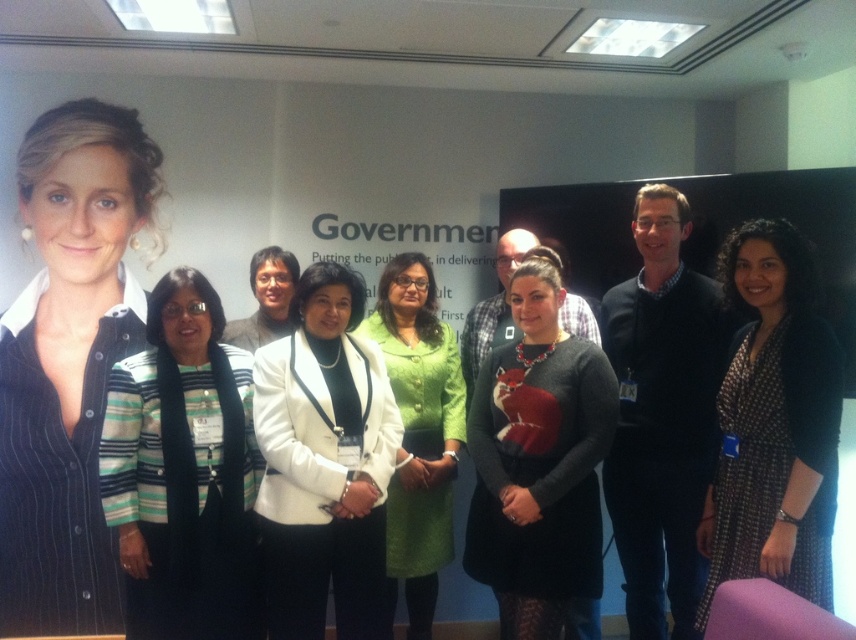
Is gray sweater at center to the left of green textured skirt at center from the viewer's perspective?

No, gray sweater at center is not to the left of green textured skirt at center.

Is gray sweater at center smaller than green textured skirt at center?

Yes.

Describe the element at coordinates (538, 460) in the screenshot. This screenshot has height=640, width=856. I see `gray sweater at center` at that location.

Locate an element on the screen. gray sweater at center is located at coordinates (538, 460).

How distant is striped wool sweater at center from dark blue sweater at center?

striped wool sweater at center is 1.45 meters away from dark blue sweater at center.

Is striped wool sweater at center closer to camera compared to dark blue sweater at center?

Yes, it is in front of dark blue sweater at center.

Which is in front, point (211, 513) or point (613, 502)?

Point (211, 513)

This screenshot has height=640, width=856. I want to click on striped wool sweater at center, so click(183, 472).

Does white matte blazer at center have a larger size compared to green textured skirt at center?

No.

This screenshot has height=640, width=856. Identify the location of white matte blazer at center. (324, 465).